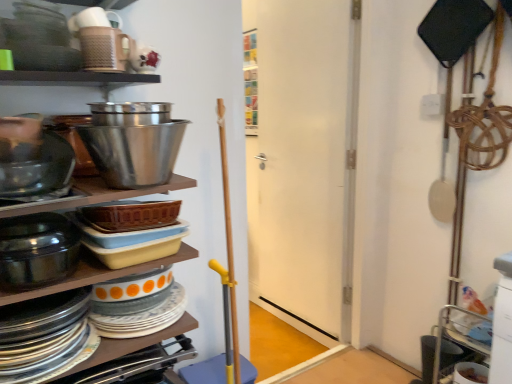
The image size is (512, 384). I want to click on shiny metallic bowl at upper center, arranged as the 3th bowl when ordered from the bottom, so click(134, 152).

The image size is (512, 384). What do you see at coordinates (71, 279) in the screenshot?
I see `matte ceramic dishes at left` at bounding box center [71, 279].

The image size is (512, 384). In order to click on shiny metallic bowl at left, the third bowl in the top-to-bottom sequence in this screenshot , I will do `click(37, 250)`.

Locate an element on the screen. matte orange and white platter at left is located at coordinates (45, 337).

From a real-world perspective, who is located higher, porcelain plates at left or matte orange and white platter at left?

In real-world perspective, matte orange and white platter at left is above.

How different are the orientations of porcelain plates at left and matte orange and white platter at left in degrees?

They differ by 0.292 degrees in their facing directions.

Is porcelain plates at left wider than matte orange and white platter at left?

In fact, porcelain plates at left might be narrower than matte orange and white platter at left.

Is point (192, 323) positioned in front of point (74, 355)?

No.

From the image's perspective, which is below, shiny metallic bowl at left, positioned as the first bowl in bottom-to-top order, or matte ceramic dishes at left?

shiny metallic bowl at left, positioned as the first bowl in bottom-to-top order, appears lower in the image.

Can you see shiny metallic bowl at left, positioned as the first bowl in bottom-to-top order, touching matte ceramic dishes at left?

shiny metallic bowl at left, positioned as the first bowl in bottom-to-top order, and matte ceramic dishes at left are clearly separated.

Considering the sizes of shiny metallic bowl at left, positioned as the first bowl in bottom-to-top order, and matte ceramic dishes at left in the image, is shiny metallic bowl at left, positioned as the first bowl in bottom-to-top order, bigger or smaller than matte ceramic dishes at left?

Clearly, shiny metallic bowl at left, positioned as the first bowl in bottom-to-top order, is smaller in size than matte ceramic dishes at left.

From a real-world perspective, between shiny metallic bowl at left, the third bowl in the top-to-bottom sequence, and matte ceramic dishes at left, who is vertically lower?

shiny metallic bowl at left, the third bowl in the top-to-bottom sequence, from a real-world perspective.

The height and width of the screenshot is (384, 512). I want to click on bowl that appears on the right of matte orange and white platter at left, so [x=134, y=152].

From a real-world perspective, is matte orange and white platter at left physically located above or below shiny metallic bowl at upper center, marked as the 1th bowl in a top-to-bottom arrangement?

In terms of real-world spatial position, matte orange and white platter at left is below shiny metallic bowl at upper center, marked as the 1th bowl in a top-to-bottom arrangement.

From a real-world perspective, is shiny metallic bowl at left, the third bowl in the top-to-bottom sequence, physically located above or below shiny metallic bowl at upper center, marked as the 1th bowl in a top-to-bottom arrangement?

In terms of real-world spatial position, shiny metallic bowl at left, the third bowl in the top-to-bottom sequence, is below shiny metallic bowl at upper center, marked as the 1th bowl in a top-to-bottom arrangement.

Are shiny metallic bowl at left, positioned as the first bowl in bottom-to-top order, and shiny metallic bowl at upper center, marked as the 1th bowl in a top-to-bottom arrangement, beside each other?

There is a gap between shiny metallic bowl at left, positioned as the first bowl in bottom-to-top order, and shiny metallic bowl at upper center, marked as the 1th bowl in a top-to-bottom arrangement.

Which of these two, shiny metallic bowl at left, positioned as the first bowl in bottom-to-top order, or shiny metallic bowl at upper center, arranged as the 3th bowl when ordered from the bottom, is wider?

shiny metallic bowl at upper center, arranged as the 3th bowl when ordered from the bottom, is wider.

Consider the image. Can you confirm if shiny metallic bowl at left, the third bowl in the top-to-bottom sequence, is positioned to the right of shiny metallic bowl at upper center, marked as the 1th bowl in a top-to-bottom arrangement?

No, shiny metallic bowl at left, the third bowl in the top-to-bottom sequence, is not to the right of shiny metallic bowl at upper center, marked as the 1th bowl in a top-to-bottom arrangement.

Looking at their sizes, would you say matte orange and white platter at left is wider or thinner than porcelain plates at left?

matte orange and white platter at left is wider than porcelain plates at left.

Can you confirm if matte orange and white platter at left is positioned to the right of porcelain plates at left?

No.

Is matte orange and white platter at left surrounding porcelain plates at left?

Actually, porcelain plates at left is outside matte orange and white platter at left.

Is porcelain plates at left bigger than white matte door at center?

Incorrect, porcelain plates at left is not larger than white matte door at center.

Between porcelain plates at left and white matte door at center, which one has larger width?

porcelain plates at left is wider.

Which object is further away from the camera taking this photo, porcelain plates at left or shiny metallic bowl at left, positioned as the first bowl in bottom-to-top order?

porcelain plates at left is behind.

Between porcelain plates at left and shiny metallic bowl at left, positioned as the first bowl in bottom-to-top order, which one has smaller size?

shiny metallic bowl at left, positioned as the first bowl in bottom-to-top order.

Can you confirm if porcelain plates at left is wider than shiny metallic bowl at left, positioned as the first bowl in bottom-to-top order?

Indeed, porcelain plates at left has a greater width compared to shiny metallic bowl at left, positioned as the first bowl in bottom-to-top order.

This screenshot has width=512, height=384. In order to click on platter above the porcelain plates at left (from the image's perspective) in this screenshot , I will do `click(45, 337)`.

Find the location of a particular element. The height and width of the screenshot is (384, 512). shelf that is above the shiny metallic bowl at left, the third bowl in the top-to-bottom sequence (from a real-world perspective) is located at coordinates (71, 279).

Which object lies nearer to the anchor point matte orange and white platter at left, shiny metallic bowl at left, the third bowl in the top-to-bottom sequence, or matte black bowl at left, acting as the 2th bowl starting from the top?

shiny metallic bowl at left, the third bowl in the top-to-bottom sequence, is closer to matte orange and white platter at left.

Estimate the real-world distances between objects in this image. Which object is further from matte ceramic dishes at left, matte black bowl at left, acting as the 2th bowl starting from the top, or white matte door at center?

white matte door at center.

Considering their positions, is matte ceramic dishes at left positioned closer to white matte door at center than matte black bowl at left, acting as the 2th bowl starting from the bottom?

Based on the image, matte ceramic dishes at left appears to be nearer to white matte door at center.

From the image, which object appears to be farther from matte ceramic dishes at left, matte orange and white platter at left or matte black bowl at left, acting as the 2th bowl starting from the bottom?

matte black bowl at left, acting as the 2th bowl starting from the bottom, is further to matte ceramic dishes at left.

Looking at this image, from the image, which object appears to be farther from matte black bowl at left, acting as the 2th bowl starting from the top, shiny metallic bowl at upper center, marked as the 1th bowl in a top-to-bottom arrangement, or shiny metallic bowl at left, positioned as the first bowl in bottom-to-top order?

shiny metallic bowl at left, positioned as the first bowl in bottom-to-top order.

Looking at the image, which one is located further to matte orange and white platter at left, shiny metallic bowl at upper center, marked as the 1th bowl in a top-to-bottom arrangement, or matte ceramic dishes at left?

shiny metallic bowl at upper center, marked as the 1th bowl in a top-to-bottom arrangement, lies further to matte orange and white platter at left than the other object.

From the image, which object appears to be nearer to matte ceramic dishes at left, matte black bowl at left, acting as the 2th bowl starting from the bottom, or shiny metallic bowl at left, the third bowl in the top-to-bottom sequence?

shiny metallic bowl at left, the third bowl in the top-to-bottom sequence, is closer to matte ceramic dishes at left.

Based on their spatial positions, is white matte door at center or shiny metallic bowl at left, the third bowl in the top-to-bottom sequence, further from matte black bowl at left, acting as the 2th bowl starting from the bottom?

Based on the image, white matte door at center appears to be further to matte black bowl at left, acting as the 2th bowl starting from the bottom.

In order to click on table between shiny metallic bowl at upper center, arranged as the 3th bowl when ordered from the bottom, and white matte door at center from front to back in this screenshot , I will do `click(132, 344)`.

Where is `bowl between matte black bowl at left, acting as the 2th bowl starting from the top, and shiny metallic bowl at upper center, marked as the 1th bowl in a top-to-bottom arrangement, in the horizontal direction`? bowl between matte black bowl at left, acting as the 2th bowl starting from the top, and shiny metallic bowl at upper center, marked as the 1th bowl in a top-to-bottom arrangement, in the horizontal direction is located at coordinates (37, 250).

I want to click on bowl between shiny metallic bowl at upper center, arranged as the 3th bowl when ordered from the bottom, and white matte door at center from front to back, so coord(39,169).

At what (x,y) coordinates should I click in order to perform the action: click on shelf between shiny metallic bowl at upper center, arranged as the 3th bowl when ordered from the bottom, and matte orange and white platter at left vertically. Please return your answer as a coordinate pair (x, y). Looking at the image, I should click on (71, 279).